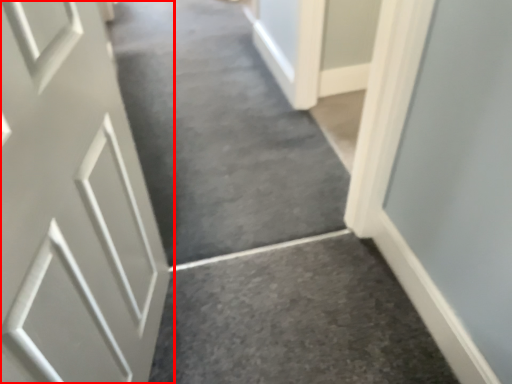
Question: From the image's perspective, where is door (annotated by the red box) located in relation to aisle in the image?

Choices:
 (A) above
 (B) below

Answer: (B)